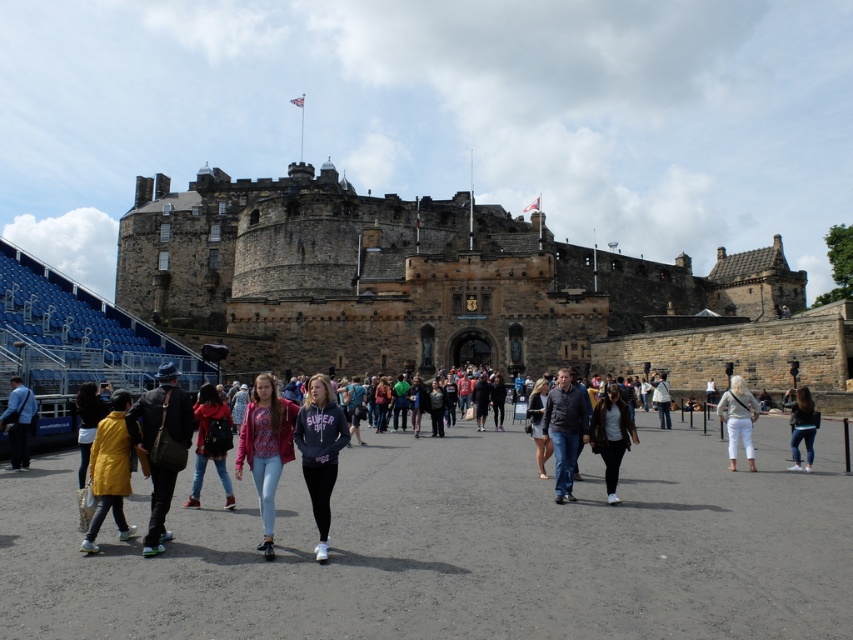
Question: Estimate the real-world distances between objects in this image. Which object is farther from the denim jeans at lower right?

Choices:
 (A) matte red backpack at center
 (B) matte pink jacket at center
 (C) blue fabric jacket at lower left
 (D) white matte jacket at center

Answer: (C)

Question: From the image, what is the correct spatial relationship of dark gray sweater at center in relation to blue fabric jacket at lower left?

Choices:
 (A) right
 (B) left

Answer: (A)

Question: Is matte pink jacket at center positioned in front of blue fabric jacket at lower left?

Choices:
 (A) no
 (B) yes

Answer: (B)

Question: Which point is closer to the camera taking this photo?

Choices:
 (A) (163, 536)
 (B) (16, 396)
 (C) (561, 426)
 (D) (196, 435)

Answer: (A)

Question: Is yellow matte jacket at lower left thinner than matte red backpack at center?

Choices:
 (A) no
 (B) yes

Answer: (A)

Question: Which point appears farthest from the camera in this image?

Choices:
 (A) (299, 422)
 (B) (259, 404)
 (C) (212, 458)
 (D) (602, 396)

Answer: (D)